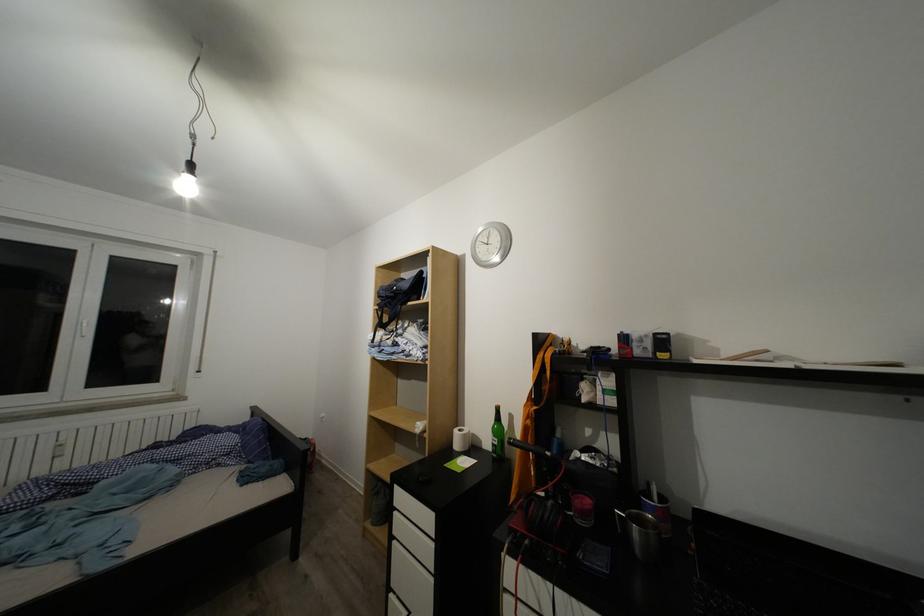
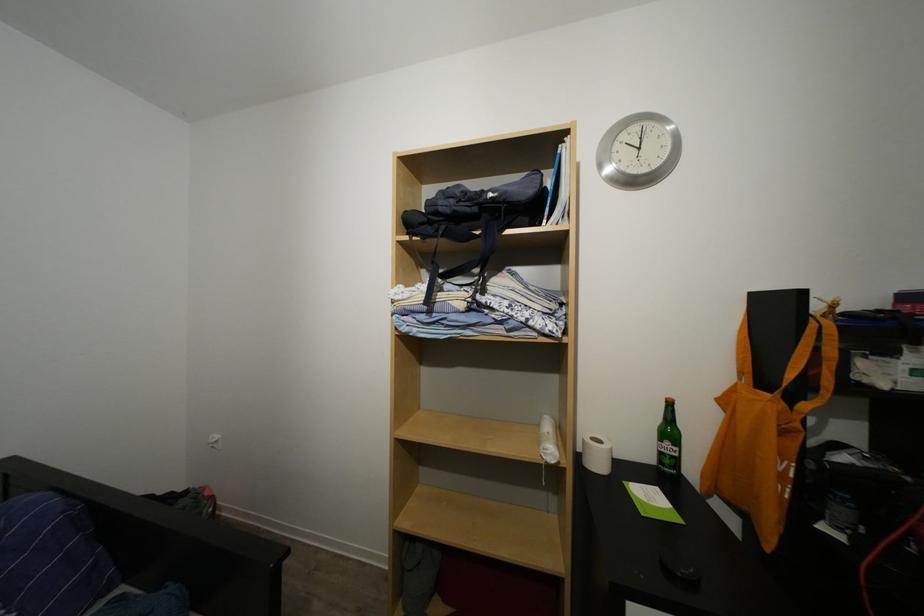
Locate, in the second image, the point that corresponds to (x=468, y=436) in the first image.

(601, 446)